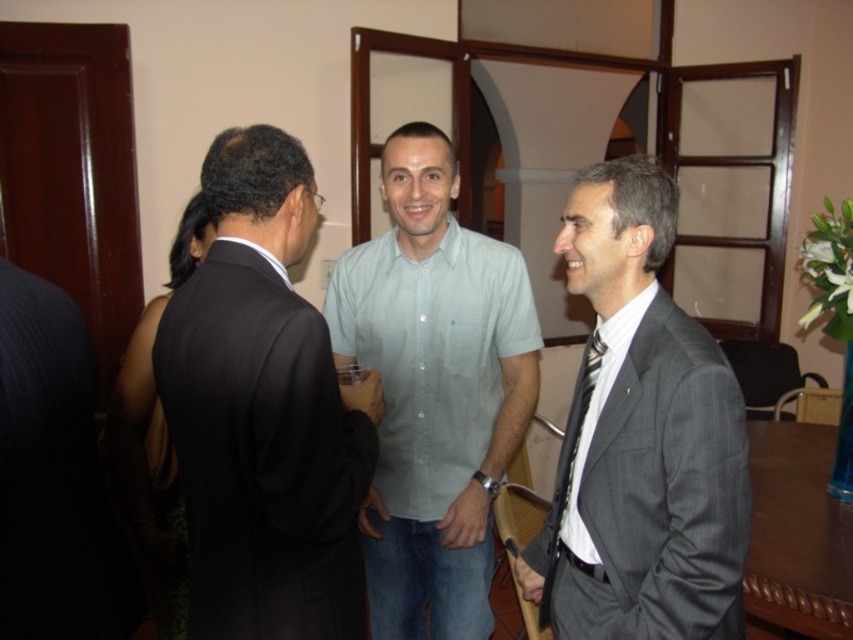
Who is more forward, (334,515) or (450,493)?

Point (334,515) is more forward.

Between dark suit at center and light blue cotton shirt at center, which one appears on the right side from the viewer's perspective?

light blue cotton shirt at center

The width and height of the screenshot is (853, 640). I want to click on dark suit at center, so 264,412.

Which of these two, gray pinstripe suit at right or black striped tie at right, stands shorter?

black striped tie at right is shorter.

Where is `gray pinstripe suit at right`? The width and height of the screenshot is (853, 640). gray pinstripe suit at right is located at coordinates (640, 438).

Describe the element at coordinates (640, 438) in the screenshot. I see `gray pinstripe suit at right` at that location.

You are a GUI agent. You are given a task and a screenshot of the screen. Output one action in this format:
    pyautogui.click(x=<x>, y=<y>)
    Task: Click on the gray pinstripe suit at right
    This screenshot has height=640, width=853.
    Given the screenshot: What is the action you would take?
    pyautogui.click(x=640, y=438)

Does gray pinstripe suit at right have a greater width compared to light blue cotton shirt at center?

No.

Which is below, gray pinstripe suit at right or light blue cotton shirt at center?

light blue cotton shirt at center

You are a GUI agent. You are given a task and a screenshot of the screen. Output one action in this format:
    pyautogui.click(x=<x>, y=<y>)
    Task: Click on the gray pinstripe suit at right
    
    Given the screenshot: What is the action you would take?
    pyautogui.click(x=640, y=438)